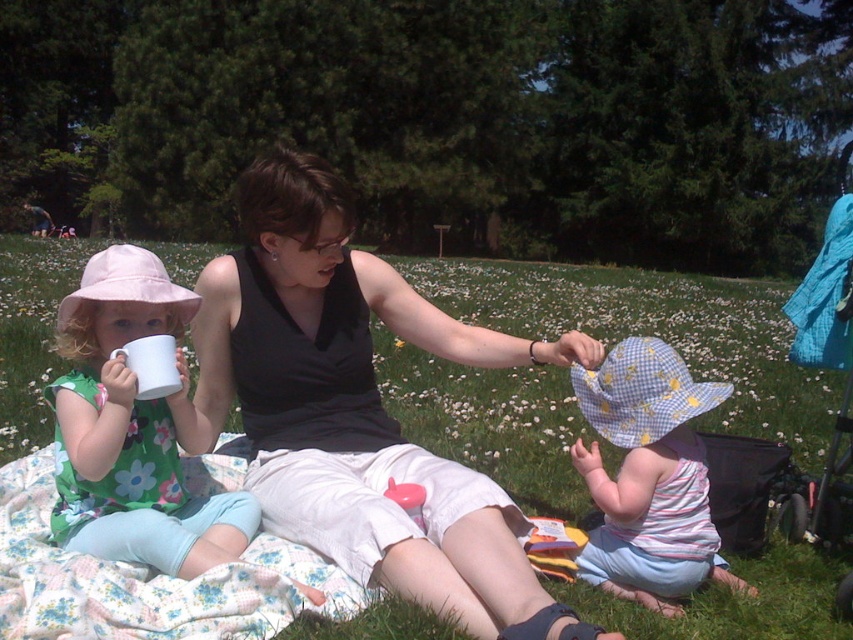
Question: Does checkered cotton hat at center appear under blue fabric stroller at right?

Choices:
 (A) yes
 (B) no

Answer: (A)

Question: Which point is closer to the camera?

Choices:
 (A) matte white cup at left
 (B) black matte tank top at center
 (C) green grass at center

Answer: (B)

Question: Which point is closer to the camera?

Choices:
 (A) green grass at center
 (B) checkered cotton hat at center
 (C) blue fabric stroller at right
 (D) matte white cup at left

Answer: (A)

Question: Estimate the real-world distances between objects in this image. Which object is farther from the green grass at center?

Choices:
 (A) checkered cotton hat at center
 (B) matte white cup at left
 (C) black matte tank top at center

Answer: (C)

Question: Is green grass at center below checkered cotton hat at center?

Choices:
 (A) yes
 (B) no

Answer: (B)

Question: Can you confirm if green grass at center is positioned below black matte tank top at center?

Choices:
 (A) no
 (B) yes

Answer: (A)